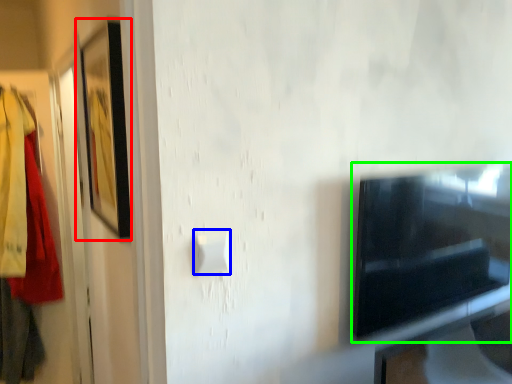
Question: Which object is the closest to the picture frame (highlighted by a red box)? Choose among these: light switch (highlighted by a blue box) or appliance (highlighted by a green box).

Choices:
 (A) light switch
 (B) appliance

Answer: (A)